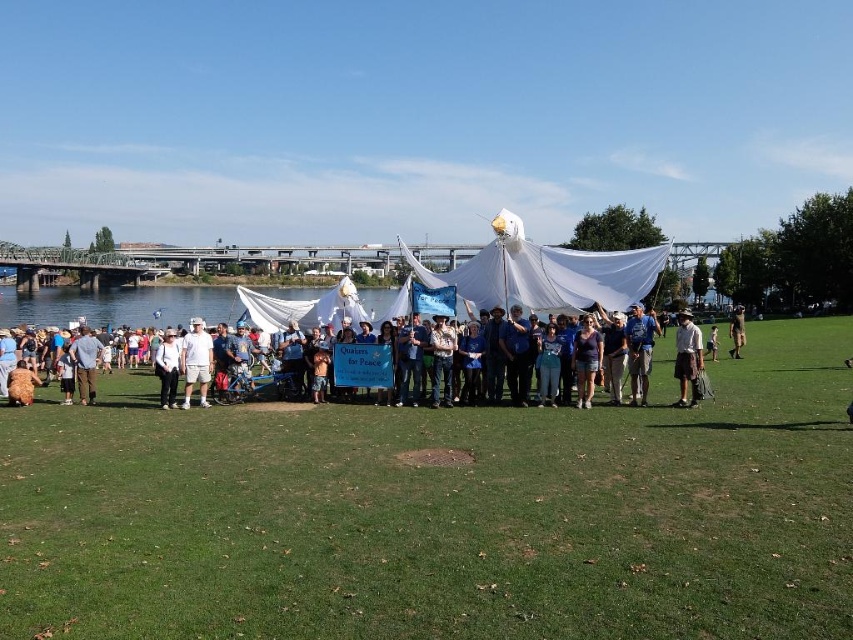
You are standing at point (688,358). What object is located exactly at your position?

The khaki fabric shorts at center is located exactly at point (688,358).

You are standing at the front of the group and want to hand out flyers to both the khaki fabric shorts at center and the white cotton shorts at center. Which pair of shorts will you reach first?

You will reach the khaki fabric shorts at center first because it is closer to you than the white cotton shorts at center.

You are a photographer at the event. You want to capture a photo that includes both the blue fabric at center and the white cotton shirt at lower left. Based on their positions, which object should appear to the right in the photo?

The blue fabric at center is positioned on the right side of white cotton shirt at lower left, so in the photo, the blue fabric at center will appear to the right of the white cotton shirt at lower left.